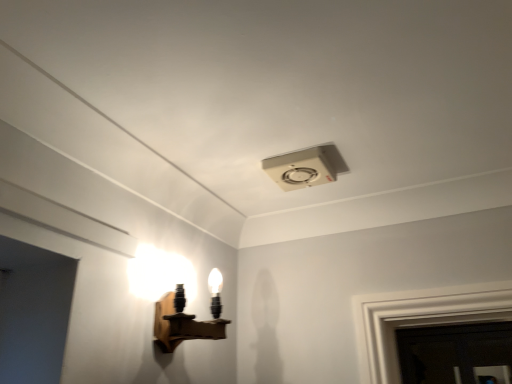
Find the location of a particular element. This screenshot has width=512, height=384. dark glass door at lower right is located at coordinates (456, 354).

Measure the distance between point (179, 335) and camera.

The depth of point (179, 335) is 3.28 feet.

Where is `dark glass door at lower right`? The width and height of the screenshot is (512, 384). dark glass door at lower right is located at coordinates pyautogui.click(x=456, y=354).

Is wooden wall sconce at left, the second lamp viewed from the right, next to white plastic ceiling fan at upper center, which is the 2th lamp in left-to-right order?

There is a gap between wooden wall sconce at left, the second lamp viewed from the right, and white plastic ceiling fan at upper center, which is the 2th lamp in left-to-right order.

Does wooden wall sconce at left, the second lamp viewed from the right, have a smaller size compared to white plastic ceiling fan at upper center, which appears as the first lamp when viewed from the right?

Actually, wooden wall sconce at left, the second lamp viewed from the right, might be larger than white plastic ceiling fan at upper center, which appears as the first lamp when viewed from the right.

Considering the relative sizes of wooden wall sconce at left, which is the 1th lamp from left to right, and white plastic ceiling fan at upper center, which appears as the first lamp when viewed from the right, in the image provided, is wooden wall sconce at left, which is the 1th lamp from left to right, wider than white plastic ceiling fan at upper center, which appears as the first lamp when viewed from the right,?

No, wooden wall sconce at left, which is the 1th lamp from left to right, is not wider than white plastic ceiling fan at upper center, which appears as the first lamp when viewed from the right.

Who is shorter, wooden wall sconce at left, the 1th lamp when ordered from bottom to top, or white plastic ceiling fan at upper center, which is the 2th lamp in left-to-right order?

With less height is white plastic ceiling fan at upper center, which is the 2th lamp in left-to-right order.

In the scene shown: What's the angular difference between dark glass door at lower right and wooden wall sconce at left, the 1th lamp when ordered from bottom to top,'s facing directions?

They differ by 89.9 degrees in their facing directions.

Considering the positions of objects dark glass door at lower right and wooden wall sconce at left, which is the 1th lamp from left to right, in the image provided, who is in front, dark glass door at lower right or wooden wall sconce at left, which is the 1th lamp from left to right,?

wooden wall sconce at left, which is the 1th lamp from left to right.

Which of these two, dark glass door at lower right or wooden wall sconce at left, the second lamp viewed from the right, is smaller?

wooden wall sconce at left, the second lamp viewed from the right.

Where is `door on the right of the wooden wall sconce at left, which is the 1th lamp from left to right`? This screenshot has width=512, height=384. door on the right of the wooden wall sconce at left, which is the 1th lamp from left to right is located at coordinates (456, 354).

From a real-world perspective, is white plastic ceiling fan at upper center, which is the first lamp from top to bottom, positioned under dark glass door at lower right based on gravity?

No.

Are white plastic ceiling fan at upper center, the second lamp when ordered from bottom to top, and dark glass door at lower right far apart?

Absolutely, white plastic ceiling fan at upper center, the second lamp when ordered from bottom to top, is distant from dark glass door at lower right.

Is white plastic ceiling fan at upper center, which appears as the first lamp when viewed from the right, to the left of dark glass door at lower right from the viewer's perspective?

Yes, white plastic ceiling fan at upper center, which appears as the first lamp when viewed from the right, is to the left of dark glass door at lower right.

Is white plastic ceiling fan at upper center, which is the 2th lamp in left-to-right order, further to the viewer compared to dark glass door at lower right?

No, it is not.

Do you think wooden wall sconce at left, which appears as the 2th lamp when viewed from the top, is within dark glass door at lower right, or outside of it?

wooden wall sconce at left, which appears as the 2th lamp when viewed from the top, exists outside the volume of dark glass door at lower right.

How different are the orientations of wooden wall sconce at left, which appears as the 2th lamp when viewed from the top, and dark glass door at lower right in degrees?

wooden wall sconce at left, which appears as the 2th lamp when viewed from the top, and dark glass door at lower right are facing 89.9 degrees away from each other.

Is wooden wall sconce at left, the second lamp viewed from the right, shorter than dark glass door at lower right?

Indeed, wooden wall sconce at left, the second lamp viewed from the right, has a lesser height compared to dark glass door at lower right.

Who is smaller, wooden wall sconce at left, which appears as the 2th lamp when viewed from the top, or dark glass door at lower right?

wooden wall sconce at left, which appears as the 2th lamp when viewed from the top.

Does point (487, 324) come closer to viewer compared to point (286, 175)?

No, (487, 324) is behind (286, 175).

From a real-world perspective, does dark glass door at lower right stand above white plastic ceiling fan at upper center, which appears as the first lamp when viewed from the right?

No, from a real-world perspective, dark glass door at lower right is not above white plastic ceiling fan at upper center, which appears as the first lamp when viewed from the right.

Is dark glass door at lower right turned away from white plastic ceiling fan at upper center, which is the first lamp from top to bottom?

No, dark glass door at lower right is not facing the opposite direction of white plastic ceiling fan at upper center, which is the first lamp from top to bottom.

In terms of height, does dark glass door at lower right look taller or shorter compared to white plastic ceiling fan at upper center, which is the 2th lamp in left-to-right order?

dark glass door at lower right is taller than white plastic ceiling fan at upper center, which is the 2th lamp in left-to-right order.

From the image's perspective, relative to wooden wall sconce at left, which appears as the 2th lamp when viewed from the top, is white plastic ceiling fan at upper center, the second lamp when ordered from bottom to top, above or below?

Clearly, from the image's perspective, white plastic ceiling fan at upper center, the second lamp when ordered from bottom to top, is above wooden wall sconce at left, which appears as the 2th lamp when viewed from the top.

Can you confirm if white plastic ceiling fan at upper center, which is the first lamp from top to bottom, is thinner than wooden wall sconce at left, the second lamp viewed from the right?

No.

Which of these two, white plastic ceiling fan at upper center, which appears as the first lamp when viewed from the right, or wooden wall sconce at left, the 1th lamp when ordered from bottom to top, stands shorter?

white plastic ceiling fan at upper center, which appears as the first lamp when viewed from the right.

Where is `lamp that appears above the wooden wall sconce at left, which appears as the 2th lamp when viewed from the top (from a real-world perspective)`? The height and width of the screenshot is (384, 512). lamp that appears above the wooden wall sconce at left, which appears as the 2th lamp when viewed from the top (from a real-world perspective) is located at coordinates (305, 167).

Image resolution: width=512 pixels, height=384 pixels. Identify the location of lamp that appears below the white plastic ceiling fan at upper center, the second lamp when ordered from bottom to top (from a real-world perspective). (188, 317).

Starting from the dark glass door at lower right, which lamp is the 2nd one in front? Please provide its 2D coordinates.

[(188, 317)]

Considering their positions, is wooden wall sconce at left, which appears as the 2th lamp when viewed from the top, positioned closer to dark glass door at lower right than white plastic ceiling fan at upper center, which is the first lamp from top to bottom?

wooden wall sconce at left, which appears as the 2th lamp when viewed from the top, is closer to dark glass door at lower right.

When comparing their distances from dark glass door at lower right, does white plastic ceiling fan at upper center, which is the 2th lamp in left-to-right order, or wooden wall sconce at left, the 1th lamp when ordered from bottom to top, seem further?

white plastic ceiling fan at upper center, which is the 2th lamp in left-to-right order, is further to dark glass door at lower right.

Considering their positions, is wooden wall sconce at left, which appears as the 2th lamp when viewed from the top, positioned closer to white plastic ceiling fan at upper center, which is the 2th lamp in left-to-right order, than dark glass door at lower right?

wooden wall sconce at left, which appears as the 2th lamp when viewed from the top.

Considering their positions, is white plastic ceiling fan at upper center, which is the 2th lamp in left-to-right order, positioned further to wooden wall sconce at left, the 1th lamp when ordered from bottom to top, than dark glass door at lower right?

dark glass door at lower right is positioned further to the anchor wooden wall sconce at left, the 1th lamp when ordered from bottom to top.

Considering their positions, is dark glass door at lower right positioned closer to white plastic ceiling fan at upper center, which is the first lamp from top to bottom, than wooden wall sconce at left, which is the 1th lamp from left to right?

Among the two, wooden wall sconce at left, which is the 1th lamp from left to right, is located nearer to white plastic ceiling fan at upper center, which is the first lamp from top to bottom.

Looking at the image, which one is located closer to wooden wall sconce at left, which is the 1th lamp from left to right, dark glass door at lower right or white plastic ceiling fan at upper center, which is the first lamp from top to bottom?

white plastic ceiling fan at upper center, which is the first lamp from top to bottom, lies closer to wooden wall sconce at left, which is the 1th lamp from left to right, than the other object.

This screenshot has width=512, height=384. Identify the location of lamp between wooden wall sconce at left, the 1th lamp when ordered from bottom to top, and dark glass door at lower right in the front-back direction. coord(305,167).